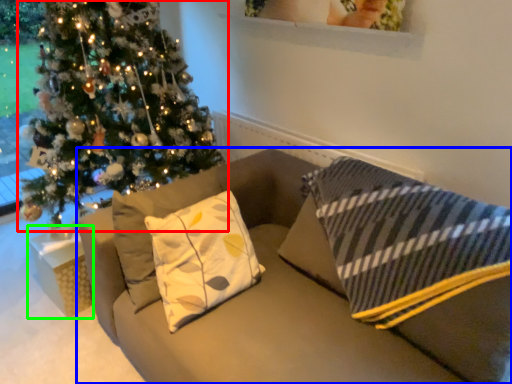
Question: Which object is positioned closest to christmas tree (highlighted by a red box)? Select from studio couch (highlighted by a blue box) and furniture (highlighted by a green box).

Choices:
 (A) studio couch
 (B) furniture

Answer: (B)